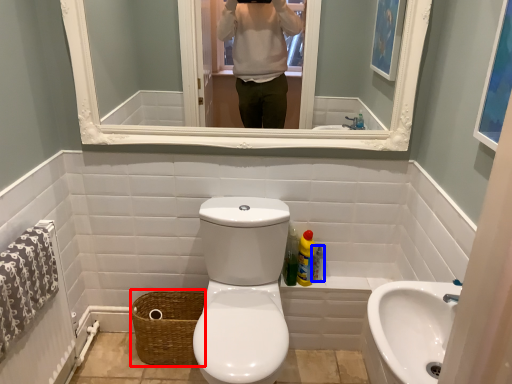
Question: Which object is closer to the camera taking this photo, basket (highlighted by a red box) or toiletry (highlighted by a blue box)?

Choices:
 (A) basket
 (B) toiletry

Answer: (A)